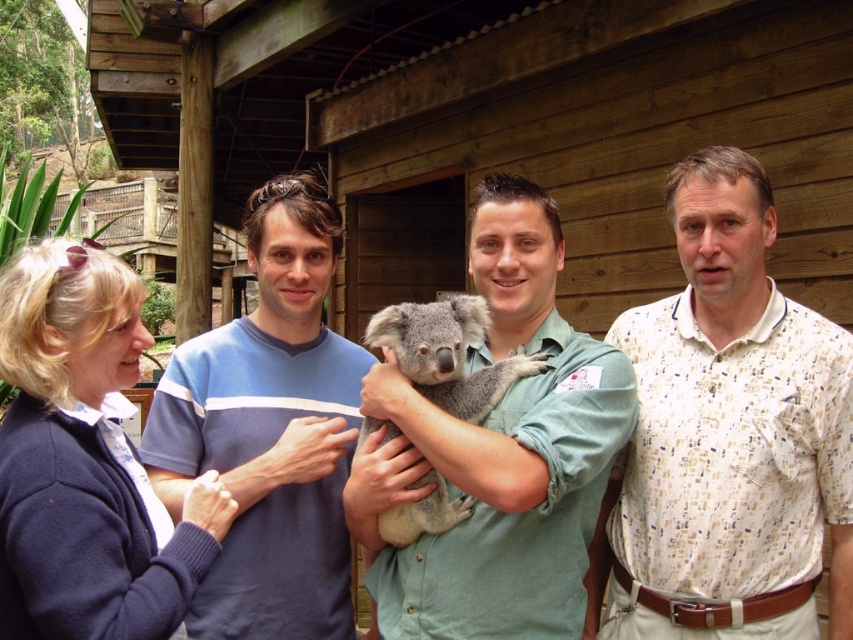
Question: In this image, where is green shirt at center located relative to gray furry koala at center?

Choices:
 (A) below
 (B) above

Answer: (B)

Question: Which of these objects is positioned farthest from the blue cotton sweater at center?

Choices:
 (A) gray furry koala at center
 (B) green shirt at center

Answer: (B)

Question: Is white printed shirt at right below green shirt at center?

Choices:
 (A) no
 (B) yes

Answer: (B)

Question: Does navy blue sweater at lower left appear over gray furry koala at center?

Choices:
 (A) no
 (B) yes

Answer: (B)

Question: Which point is farther to the camera?

Choices:
 (A) green shirt at center
 (B) gray furry koala at center
 (C) blue cotton sweater at center
 (D) white printed shirt at right

Answer: (C)

Question: Which point appears closest to the camera in this image?

Choices:
 (A) (451, 320)
 (B) (310, 250)

Answer: (A)